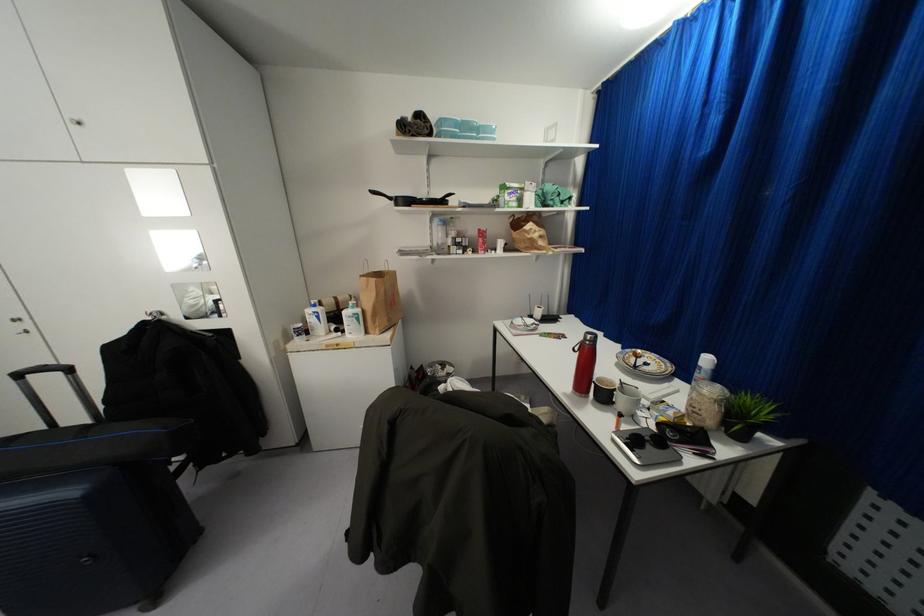
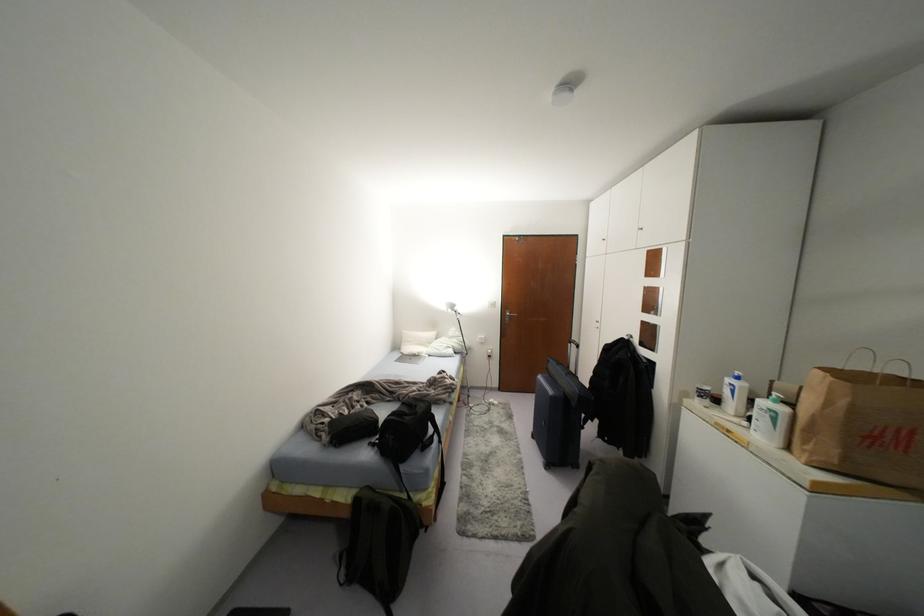
Question: How did the camera likely rotate?

Choices:
 (A) Left
 (B) Right
 (C) Up
 (D) Down

Answer: (A)